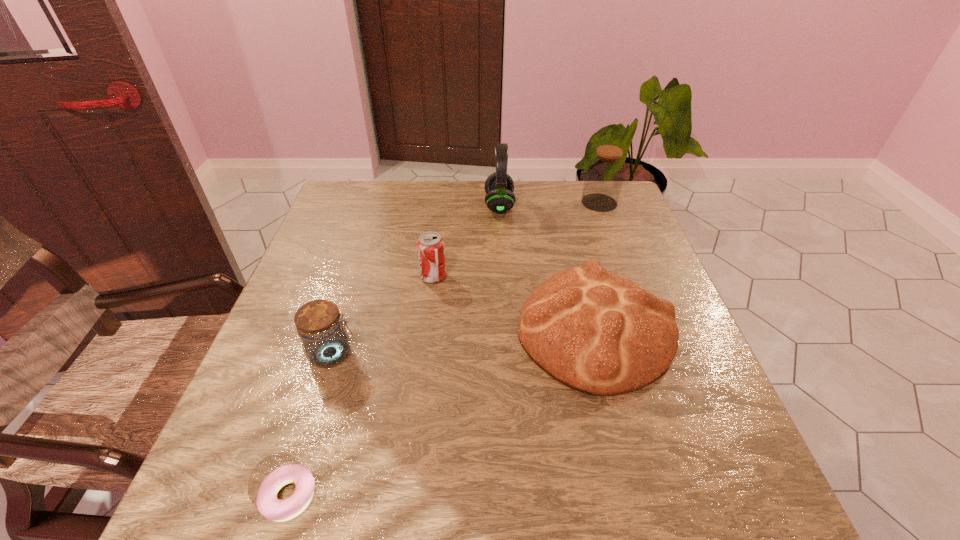
This screenshot has width=960, height=540. I want to click on free space at the far left corner of the desktop, so click(x=372, y=190).

Where is `free space that is in between the nearest object and the left jar`? The image size is (960, 540). free space that is in between the nearest object and the left jar is located at coordinates (311, 425).

You are a GUI agent. You are given a task and a screenshot of the screen. Output one action in this format:
    pyautogui.click(x=<x>, y=<y>)
    Task: Click on the unoccupied area between the shorter jar and the nearest object
    Image resolution: width=960 pixels, height=540 pixels.
    Given the screenshot: What is the action you would take?
    pyautogui.click(x=311, y=425)

Where is `unoccupied area between the nearer jar and the headset`? The image size is (960, 540). unoccupied area between the nearer jar and the headset is located at coordinates (416, 279).

The height and width of the screenshot is (540, 960). I want to click on free space between the soda can and the nearer jar, so pyautogui.click(x=383, y=315).

Where is `free space between the bread and the nearest object`? free space between the bread and the nearest object is located at coordinates (442, 413).

Locate an element on the screen. This screenshot has height=540, width=960. free space between the right jar and the headset is located at coordinates (549, 204).

Where is `free area in between the bread and the headset`? The width and height of the screenshot is (960, 540). free area in between the bread and the headset is located at coordinates (547, 268).

The width and height of the screenshot is (960, 540). I want to click on the fifth closest object relative to the farther jar, so click(x=269, y=506).

Identify the location of object identified as the fourth closest to the taller jar. This screenshot has height=540, width=960. (325, 342).